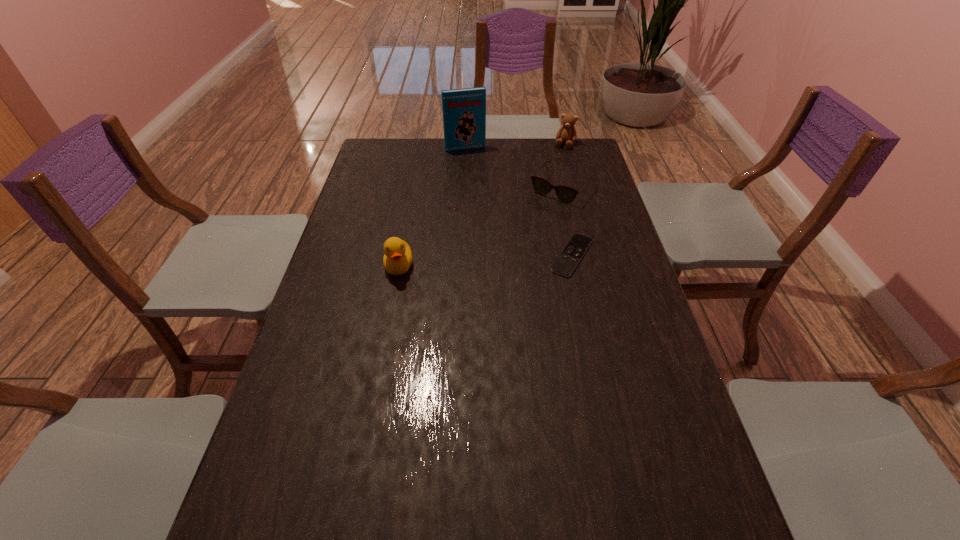
Where is `vacant space on the desktop that is between the duckling and the shortest object and is positioned on the face of the teddy bear`? The height and width of the screenshot is (540, 960). vacant space on the desktop that is between the duckling and the shortest object and is positioned on the face of the teddy bear is located at coordinates (507, 260).

The height and width of the screenshot is (540, 960). Identify the location of free space on the desktop that is between the leftmost object and the shortest object and is positioned at the front view of the fourth tallest object. [497, 260].

The image size is (960, 540). Identify the location of vacant space on the desktop that is between the leftmost object and the shortest object and is positioned on the front cover of the fourth object from right to left. (509, 260).